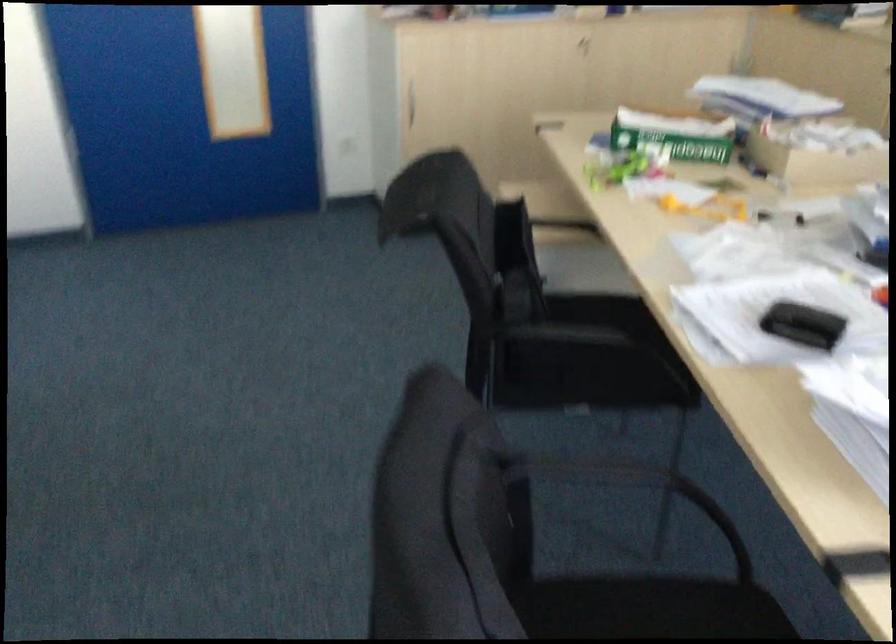
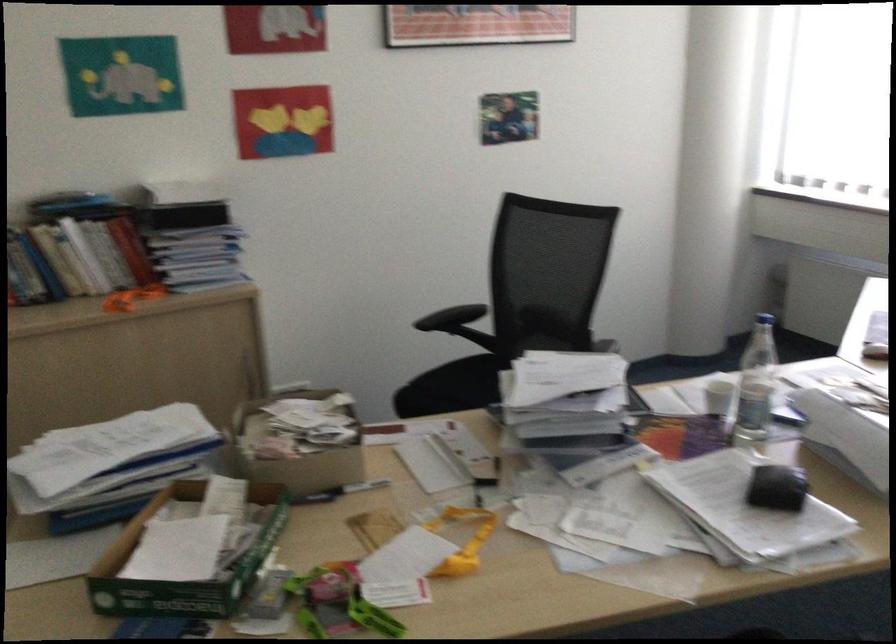
Locate, in the second image, the point that corresponds to the point at 791,131 in the first image.

(298, 442)